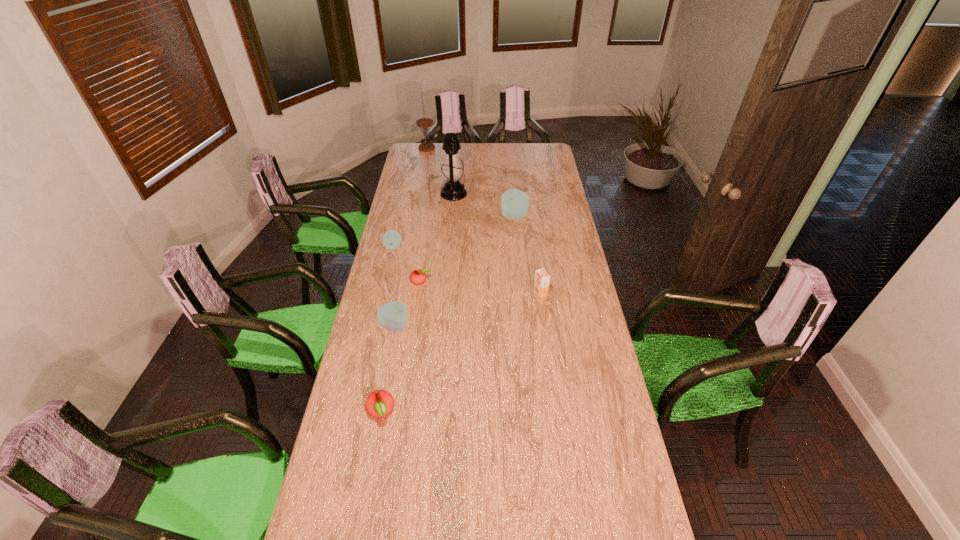
Locate an element on the screen. The width and height of the screenshot is (960, 540). free spot located 0.390m on the right of the smallest white apple is located at coordinates (485, 247).

The width and height of the screenshot is (960, 540). In order to click on free spot located 0.290m on the front of the bigger red apple in this screenshot , I will do click(x=359, y=527).

Locate an element on the screen. The image size is (960, 540). vacant space located on the front of the third nearest apple is located at coordinates (417, 313).

You are a GUI agent. You are given a task and a screenshot of the screen. Output one action in this format:
    pyautogui.click(x=<x>, y=<y>)
    Task: Click on the object that is at the far edge
    
    Given the screenshot: What is the action you would take?
    pyautogui.click(x=424, y=123)

Locate an element on the screen. The image size is (960, 540). hourglass situated at the left edge is located at coordinates (424, 123).

The image size is (960, 540). Find the location of `object at the far left corner`. object at the far left corner is located at coordinates (424, 123).

Locate an element on the screen. The image size is (960, 540). vacant space at the left edge is located at coordinates (388, 260).

In the image, there is a desktop. Identify the location of vacant space at the right edge. (594, 315).

Identify the location of free space at the far right corner of the desktop. (534, 150).

This screenshot has height=540, width=960. In order to click on free spot between the second nearest object and the nearest apple in this screenshot , I will do `click(388, 369)`.